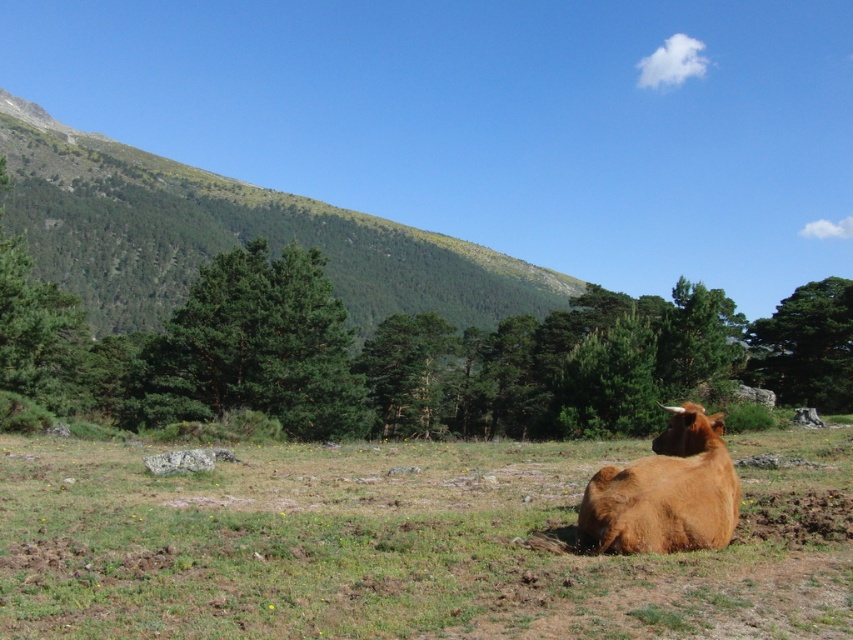
Where is `green grassy hillside at upper left`? green grassy hillside at upper left is located at coordinates (228, 236).

Is the position of green grassy hillside at upper left less distant than that of brown furry bull at lower right?

That is False.

In order to click on green grassy hillside at upper left in this screenshot , I will do `click(228, 236)`.

Find the location of a particular element. green grassy hillside at upper left is located at coordinates (228, 236).

Does brown grassy field at center appear on the left side of brown furry bull at lower right?

Indeed, brown grassy field at center is positioned on the left side of brown furry bull at lower right.

Which is above, brown grassy field at center or brown furry bull at lower right?

brown furry bull at lower right is above.

Between point (62, 582) and point (625, 529), which one is positioned behind?

Positioned behind is point (625, 529).

The width and height of the screenshot is (853, 640). Find the location of `brown grassy field at center`. brown grassy field at center is located at coordinates (404, 545).

Does brown grassy field at center appear on the right side of green grassy hillside at upper left?

Indeed, brown grassy field at center is positioned on the right side of green grassy hillside at upper left.

Can you confirm if brown grassy field at center is shorter than green grassy hillside at upper left?

Yes, brown grassy field at center is shorter than green grassy hillside at upper left.

At what (x,y) coordinates should I click in order to perform the action: click on brown grassy field at center. Please return your answer as a coordinate pair (x, y). Image resolution: width=853 pixels, height=640 pixels. Looking at the image, I should click on (404, 545).

Where is `brown grassy field at center`? The image size is (853, 640). brown grassy field at center is located at coordinates (404, 545).